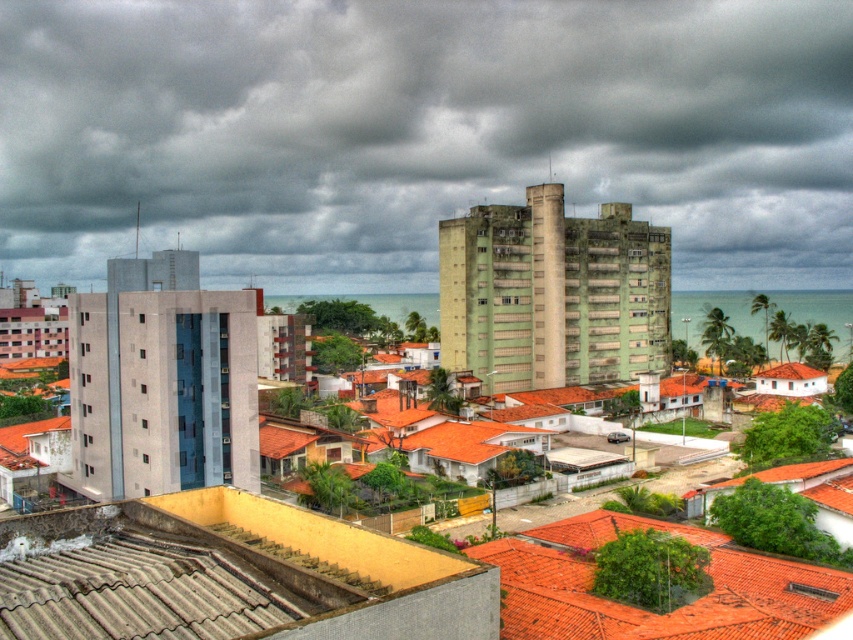
You are standing in the coastal urban area depicted in the scene. You notice the gray cloudy sky at upper center and the gray corrugated metal roof at lower left. Which object appears closer to you, the observer?

The gray cloudy sky at upper center is further away than the gray corrugated metal roof at lower left, so the gray corrugated metal roof at lower left appears closer to you.

You are a delivery drone that needs to land on a roof. You have a wingspan of 1.2 meters. Which of the two roofs, the gray corrugated metal roof at lower left or the orange tile roof at lower right, can accommodate your landing based on their widths?

The orange tile roof at lower right has a greater width than the gray corrugated metal roof at lower left. Since the orange tile roof at lower right is wider, it can accommodate the drone with a 1.2 meter wingspan, while the gray corrugated metal roof at lower left may be too narrow.

What is the location of the gray cloudy sky at upper center in the image?

The gray cloudy sky at upper center is located at point (421, 132).